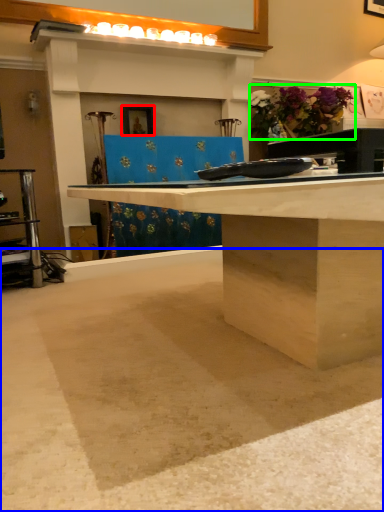
Question: Which object is the farthest from picture frame (highlighted by a red box)? Choose among these: concrete (highlighted by a blue box) or flower (highlighted by a green box).

Choices:
 (A) concrete
 (B) flower

Answer: (A)